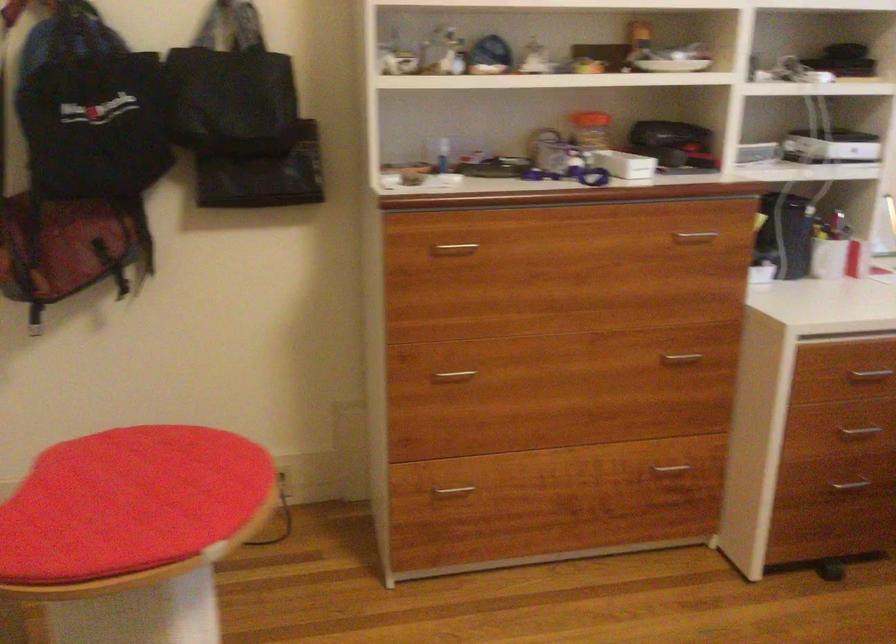
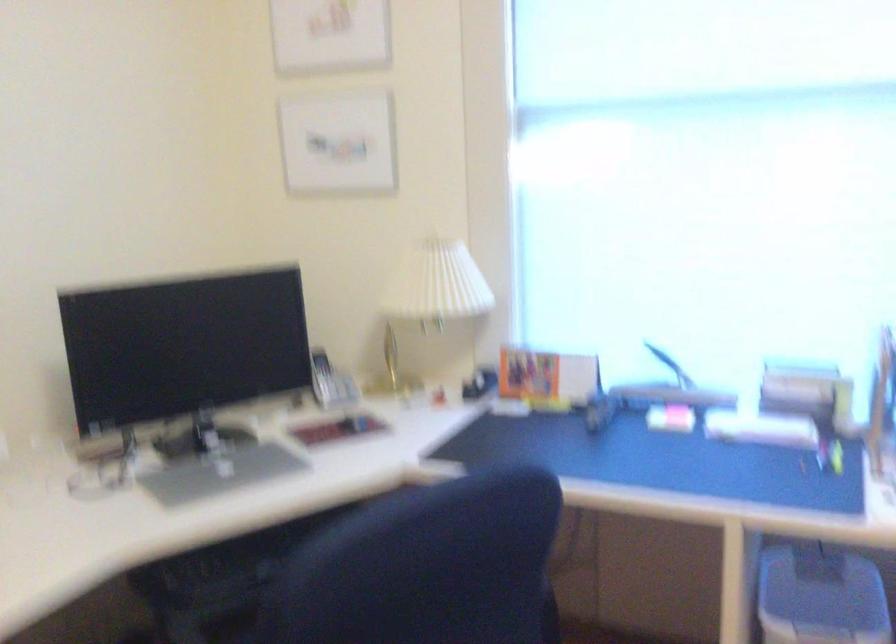
Question: The camera is either moving clockwise (left) or counter-clockwise (right) around the object. The first image is from the beginning of the video and the second image is from the end. Is the camera moving left or right when shooting the video?

Choices:
 (A) Left
 (B) Right

Answer: (A)